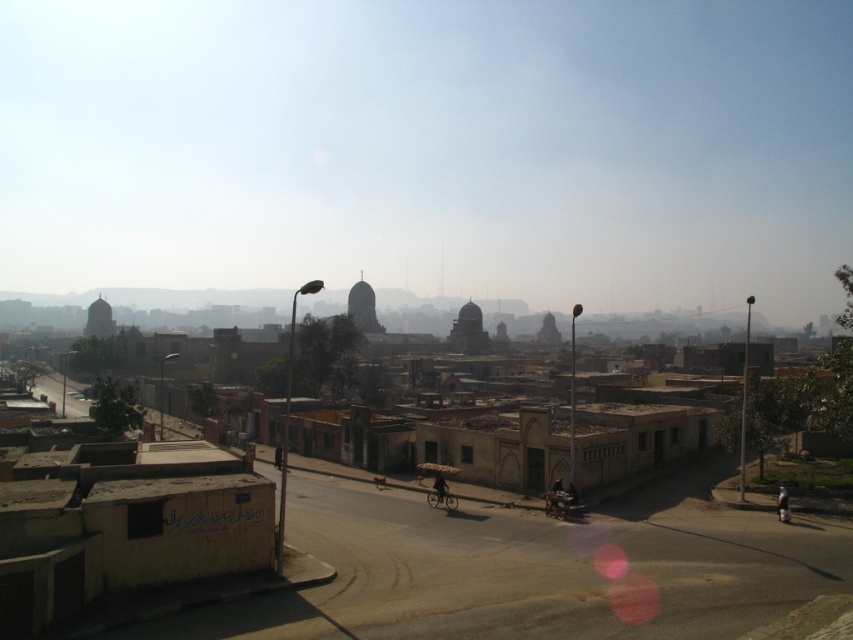
You are standing at the center of the road in the cityscape scene. You see a point marked at coordinates (782,504). What object is located at that point?

The point at coordinates (782,504) corresponds to the light brown fabric bag at lower right.

You are standing at the center of the road in the cityscape scene. You want to pick up the light brown fabric bag at lower right. In which direction should you walk to reach it?

You should walk towards the lower right direction to reach the light brown fabric bag at lower right, as it is located at point (782, 504) in the image.